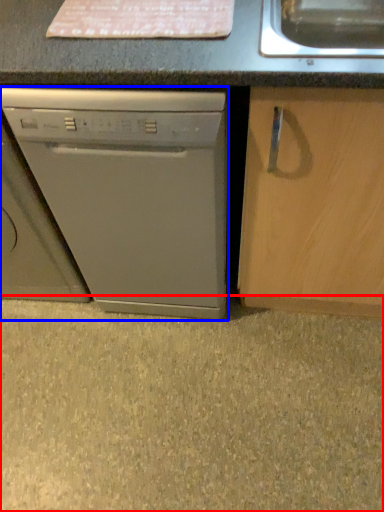
Question: Which of the following is the farthest to the observer, concrete (highlighted by a red box) or washing machine (highlighted by a blue box)?

Choices:
 (A) concrete
 (B) washing machine

Answer: (A)